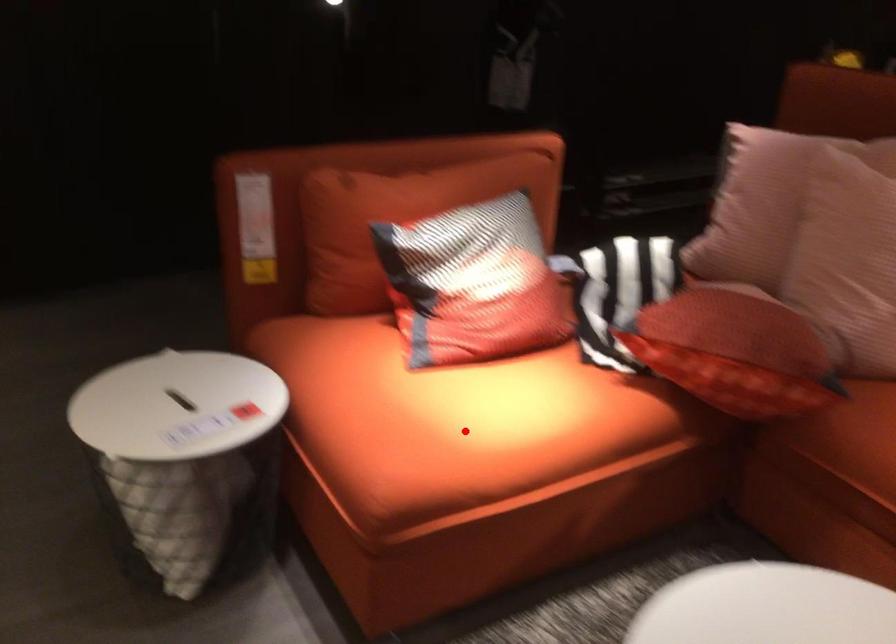
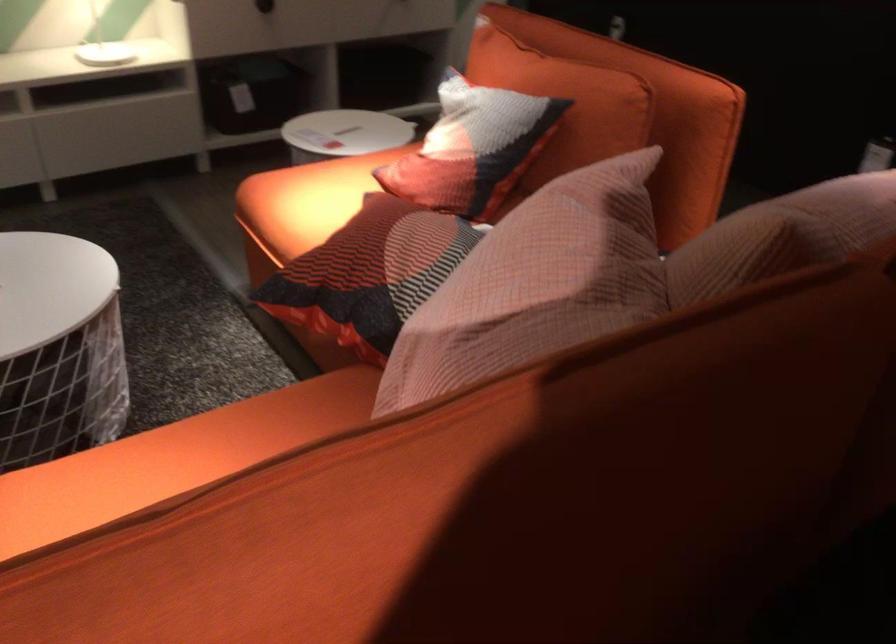
In the second image, find the point that corresponds to the highlighted location in the first image.

(306, 200)